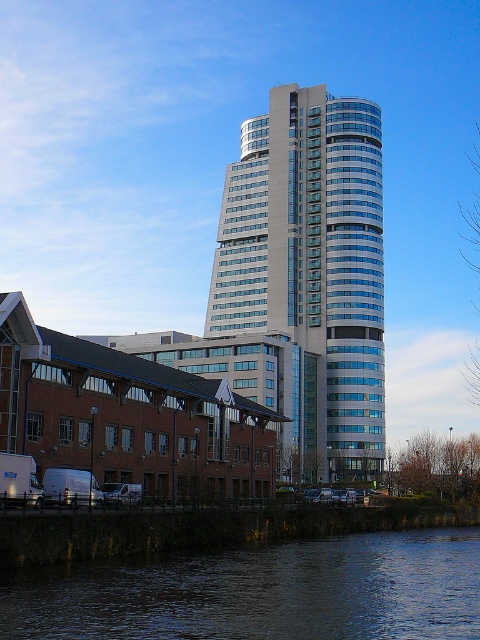
Question: Does glassy white skyscraper at center have a lesser width compared to dark blue water at lower center?

Choices:
 (A) no
 (B) yes

Answer: (A)

Question: Is glassy white skyscraper at center positioned at the back of dark blue water at lower center?

Choices:
 (A) no
 (B) yes

Answer: (B)

Question: Is glassy white skyscraper at center in front of dark blue water at lower center?

Choices:
 (A) yes
 (B) no

Answer: (B)

Question: Which object is farther from the camera taking this photo?

Choices:
 (A) glassy white skyscraper at center
 (B) dark blue water at lower center

Answer: (A)

Question: Which point is farther to the camera?

Choices:
 (A) (348, 193)
 (B) (350, 570)

Answer: (A)

Question: Which of the following is the farthest from the observer?

Choices:
 (A) (422, 580)
 (B) (288, 252)

Answer: (B)